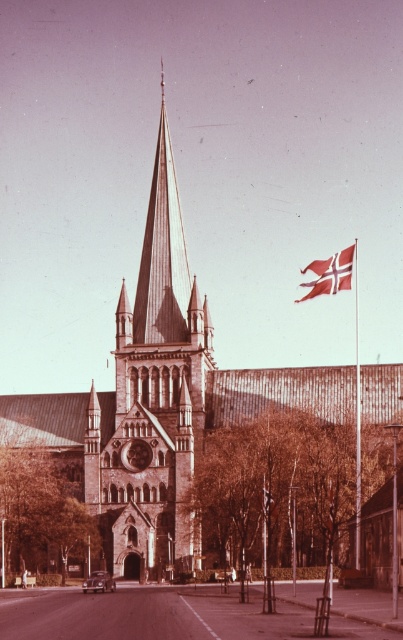
Question: Is brown stone tower at center positioned at the back of white fabric flag at upper right?

Choices:
 (A) no
 (B) yes

Answer: (A)

Question: Which point is closer to the camera?

Choices:
 (A) metallic flagpole at right
 (B) white fabric flag at upper right

Answer: (A)

Question: Which object is the farthest from the metallic flagpole at right?

Choices:
 (A) brown stone tower at center
 (B) white fabric flag at upper right

Answer: (A)

Question: Is white fabric flag at upper right bigger than metallic flagpole at right?

Choices:
 (A) no
 (B) yes

Answer: (A)

Question: Which object is farther from the camera taking this photo?

Choices:
 (A) brown stone tower at center
 (B) metallic flagpole at right

Answer: (B)

Question: Does white fabric flag at upper right lie in front of metallic flagpole at right?

Choices:
 (A) no
 (B) yes

Answer: (A)